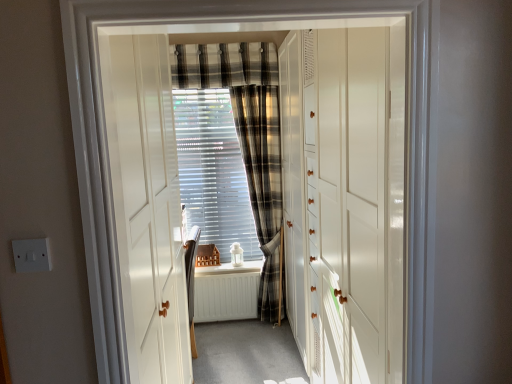
The width and height of the screenshot is (512, 384). I want to click on free point to the left of plaid fabric curtain at center, positioned as the 1th curtain in bottom-to-top order, so click(231, 334).